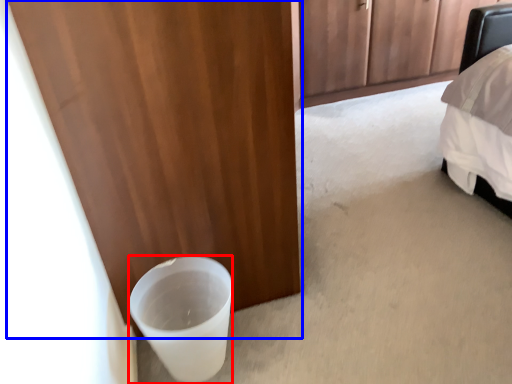
Question: Which object appears farthest to the camera in this image, beverage (highlighted by a red box) or door (highlighted by a blue box)?

Choices:
 (A) beverage
 (B) door

Answer: (A)